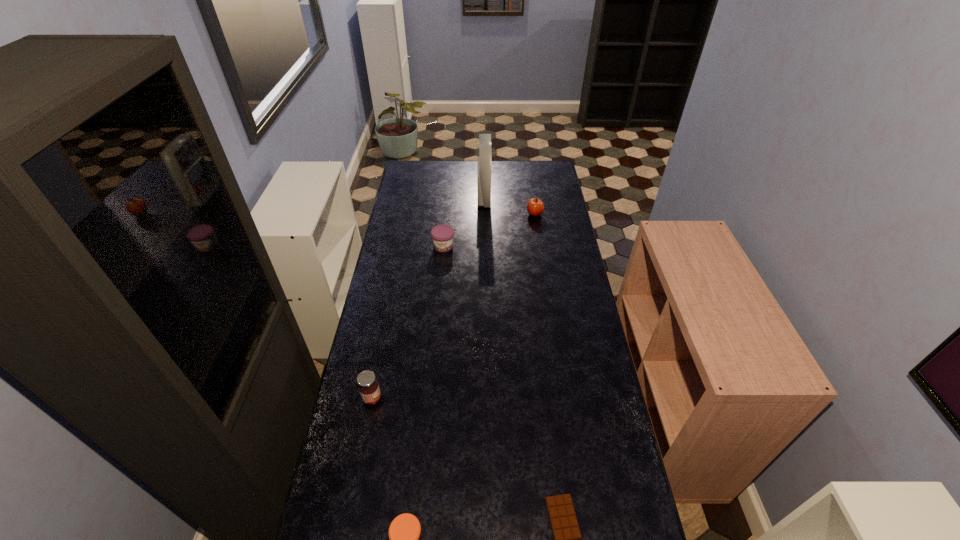
Identify which object is the second nearest to the fourth object from left to right. Please provide its 2D coordinates. Your answer should be formatted as a tuple, i.e. [(x, y)], where the tuple contains the x and y coordinates of a point satisfying the conditions above.

[(442, 236)]

Choose which object is the second nearest neighbor to the shortest object. Please provide its 2D coordinates. Your answer should be formatted as a tuple, i.e. [(x, y)], where the tuple contains the x and y coordinates of a point satisfying the conditions above.

[(368, 387)]

Where is `jam that is the closest to the shortest jam`? jam that is the closest to the shortest jam is located at coordinates (368, 387).

Locate which jam is the second closest to the apple. Please provide its 2D coordinates. Your answer should be formatted as a tuple, i.e. [(x, y)], where the tuple contains the x and y coordinates of a point satisfying the conditions above.

[(368, 387)]

Where is `free spot that satisfies the following two spatial constraints: 1. on the back side of the apple; 2. on the front-facing side of the fourth object from left to right`? The image size is (960, 540). free spot that satisfies the following two spatial constraints: 1. on the back side of the apple; 2. on the front-facing side of the fourth object from left to right is located at coordinates (532, 198).

At what (x,y) coordinates should I click in order to perform the action: click on free spot that satisfies the following two spatial constraints: 1. on the front-facing side of the apple; 2. on the right side of the fourth object from left to right. Please return your answer as a coordinate pair (x, y). This screenshot has height=540, width=960. Looking at the image, I should click on (484, 214).

Image resolution: width=960 pixels, height=540 pixels. What are the coordinates of `blank space that satisfies the following two spatial constraints: 1. on the front-facing side of the apple; 2. on the left side of the third object from right to left` in the screenshot? It's located at (484, 214).